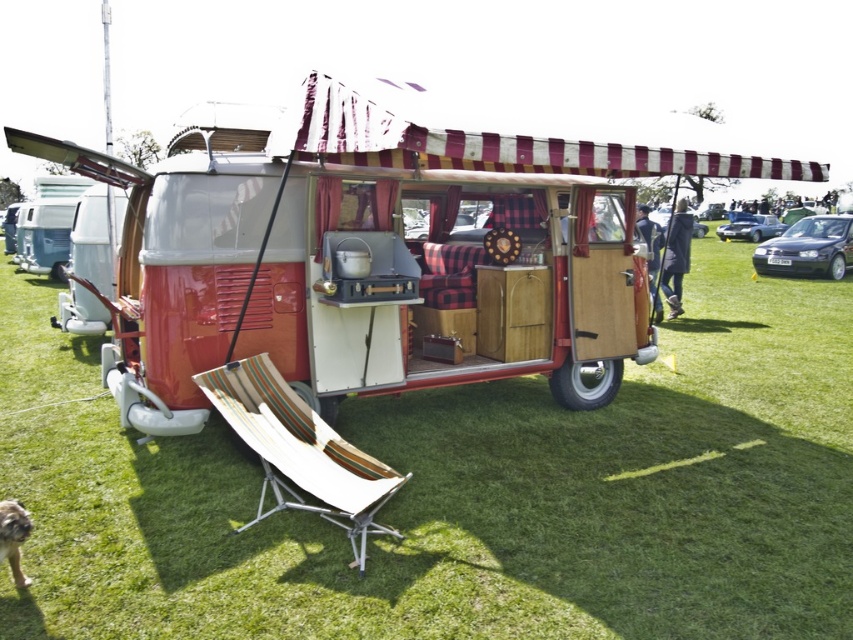
Based on the photo, who is positioned more to the left, green grassy at center or beige fabric chair at lower center?

beige fabric chair at lower center

Is green grassy at center positioned in front of beige fabric chair at lower center?

Yes.

Describe the element at coordinates (465, 493) in the screenshot. I see `green grassy at center` at that location.

Identify the location of green grassy at center. The height and width of the screenshot is (640, 853). (465, 493).

Is green grassy at center thinner than brown fur dog at lower left?

No, green grassy at center is not thinner than brown fur dog at lower left.

Can you confirm if green grassy at center is smaller than brown fur dog at lower left?

No.

The height and width of the screenshot is (640, 853). In order to click on green grassy at center in this screenshot , I will do `click(465, 493)`.

Identify the location of green grassy at center. This screenshot has height=640, width=853. (465, 493).

Measure the distance between matte red camper van at center and beige fabric chair at lower center.

matte red camper van at center is 1.41 meters from beige fabric chair at lower center.

Is matte red camper van at center smaller than beige fabric chair at lower center?

Actually, matte red camper van at center might be larger than beige fabric chair at lower center.

What do you see at coordinates (380, 259) in the screenshot? I see `matte red camper van at center` at bounding box center [380, 259].

The width and height of the screenshot is (853, 640). In order to click on matte red camper van at center in this screenshot , I will do `click(380, 259)`.